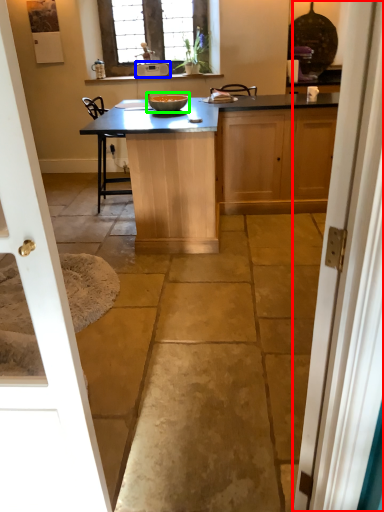
Question: Considering the real-world distances, which object is farthest from door (highlighted by a red box)? appliance (highlighted by a blue box) or glass bowl (highlighted by a green box)?

Choices:
 (A) appliance
 (B) glass bowl

Answer: (A)